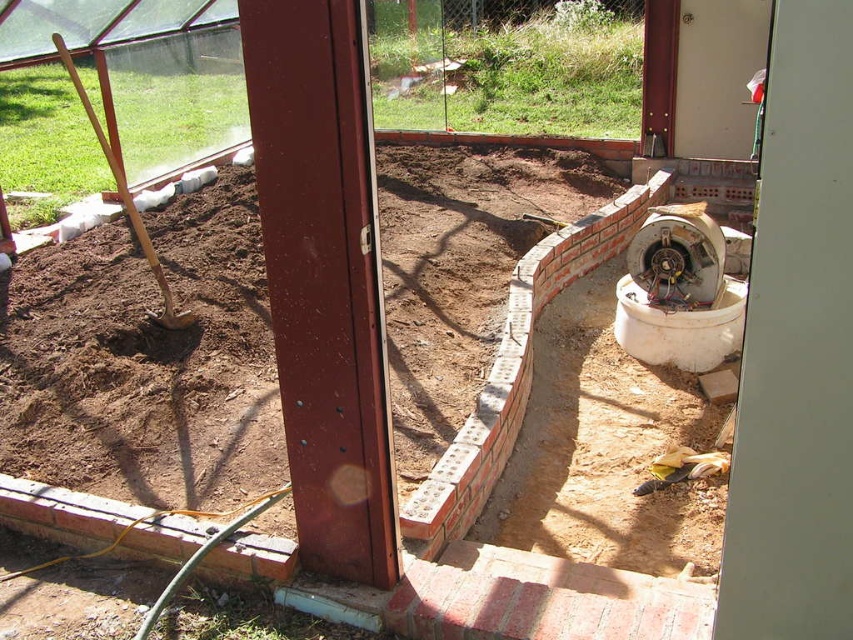
Question: Is brown soil at center bigger than wooden shovel at left?

Choices:
 (A) no
 (B) yes

Answer: (A)

Question: Which of the following is the closest to the observer?

Choices:
 (A) wooden shovel at left
 (B) brown soil at center

Answer: (B)

Question: Can you confirm if brown soil at center is smaller than wooden shovel at left?

Choices:
 (A) yes
 (B) no

Answer: (A)

Question: Observing the image, what is the correct spatial positioning of brown soil at center in reference to metallic red pillar at center?

Choices:
 (A) below
 (B) above

Answer: (B)

Question: Based on their relative distances, which object is farther from the brown soil at center?

Choices:
 (A) wooden shovel at left
 (B) metallic red pillar at center

Answer: (A)

Question: Which object is positioned closest to the brown soil at center?

Choices:
 (A) metallic red pillar at center
 (B) wooden shovel at left

Answer: (A)